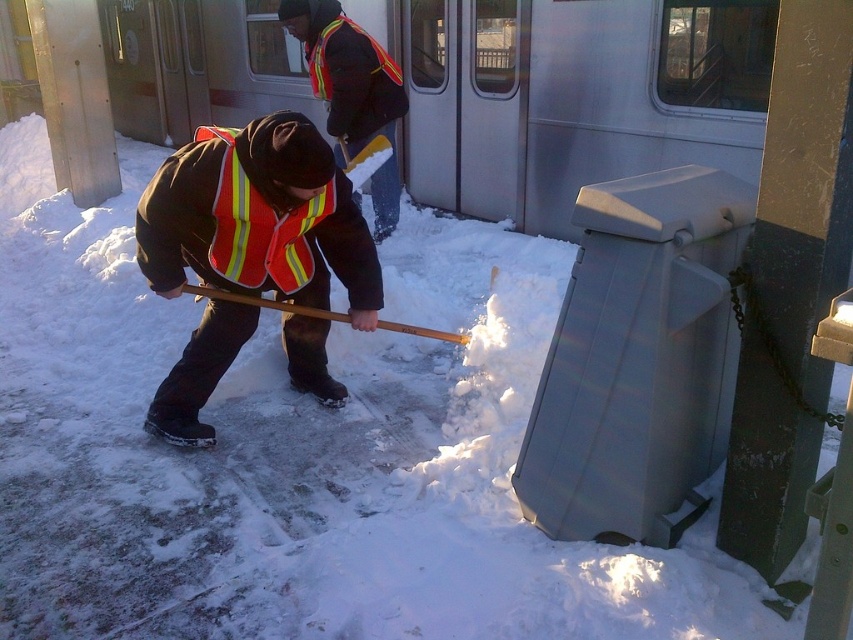
Question: Is reflective orange safety vest at center below reflective safety vest at center?

Choices:
 (A) no
 (B) yes

Answer: (B)

Question: Which object is the closest to the reflective orange safety vest at center?

Choices:
 (A) reflective safety vest at center
 (B) reflective fabric safety vest at center

Answer: (B)

Question: Which object is the farthest from the reflective fabric safety vest at center?

Choices:
 (A) reflective orange safety vest at center
 (B) reflective safety vest at center

Answer: (B)

Question: Is reflective orange safety vest at center thinner than reflective fabric safety vest at center?

Choices:
 (A) yes
 (B) no

Answer: (B)

Question: Can you confirm if reflective safety vest at center is positioned below reflective fabric safety vest at center?

Choices:
 (A) no
 (B) yes

Answer: (A)

Question: Among these objects, which one is nearest to the camera?

Choices:
 (A) reflective safety vest at center
 (B) reflective fabric safety vest at center
 (C) reflective orange safety vest at center

Answer: (C)